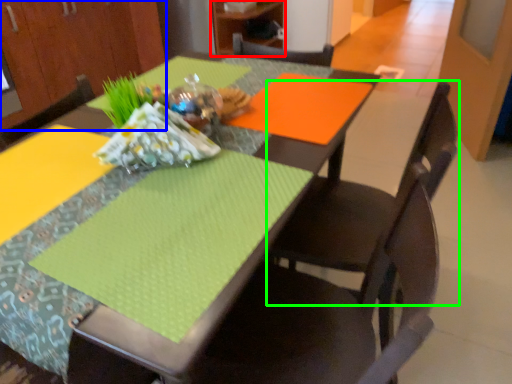
Question: Which is nearer to the cabinetry (highlighted by a red box)? cabinetry (highlighted by a blue box) or chair (highlighted by a green box).

Choices:
 (A) cabinetry
 (B) chair

Answer: (A)